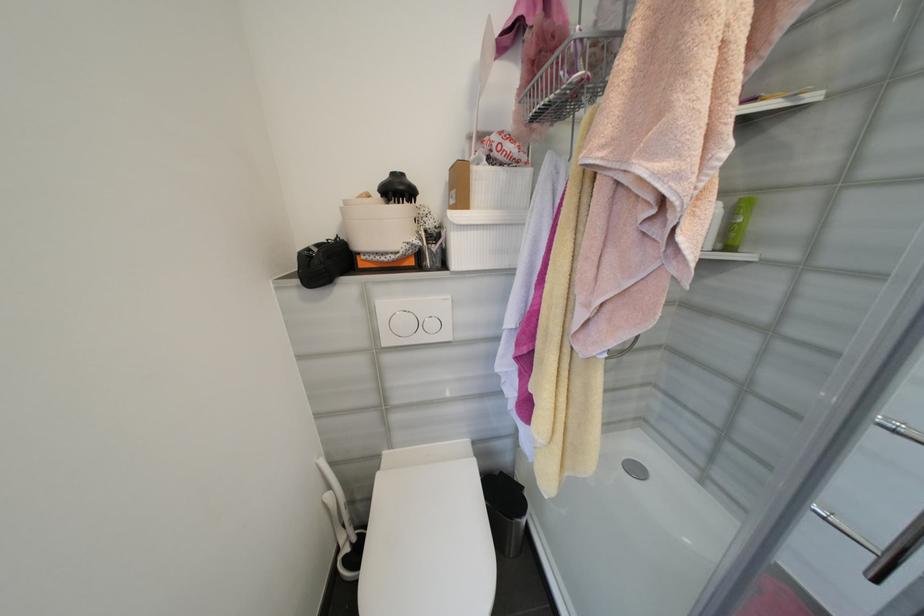
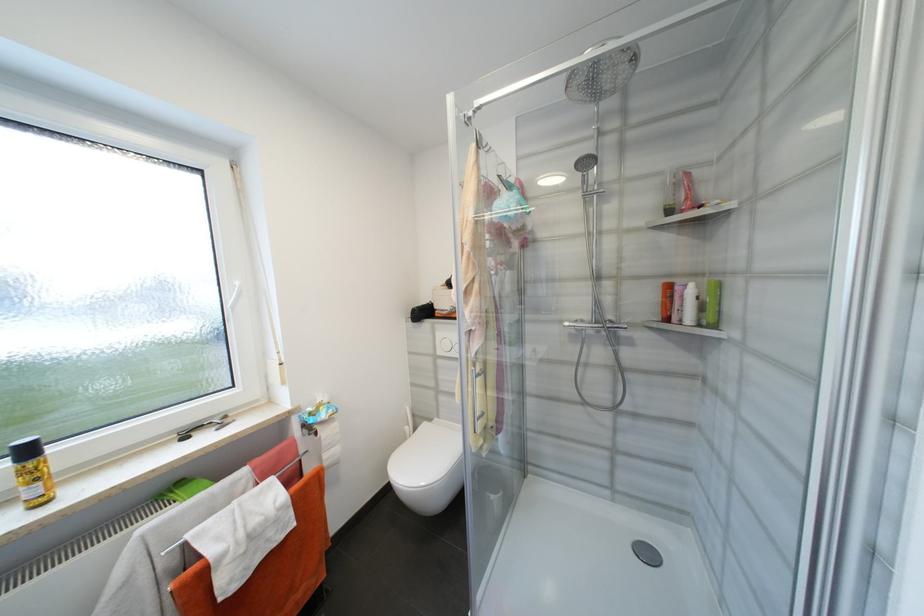
In the second image, find the point that corresponds to (x=393, y=342) in the first image.

(445, 353)